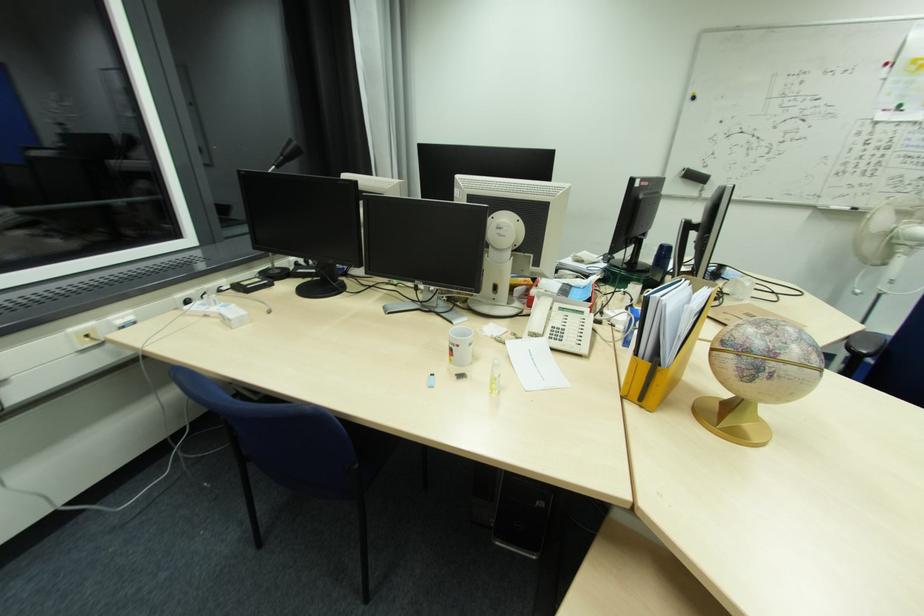
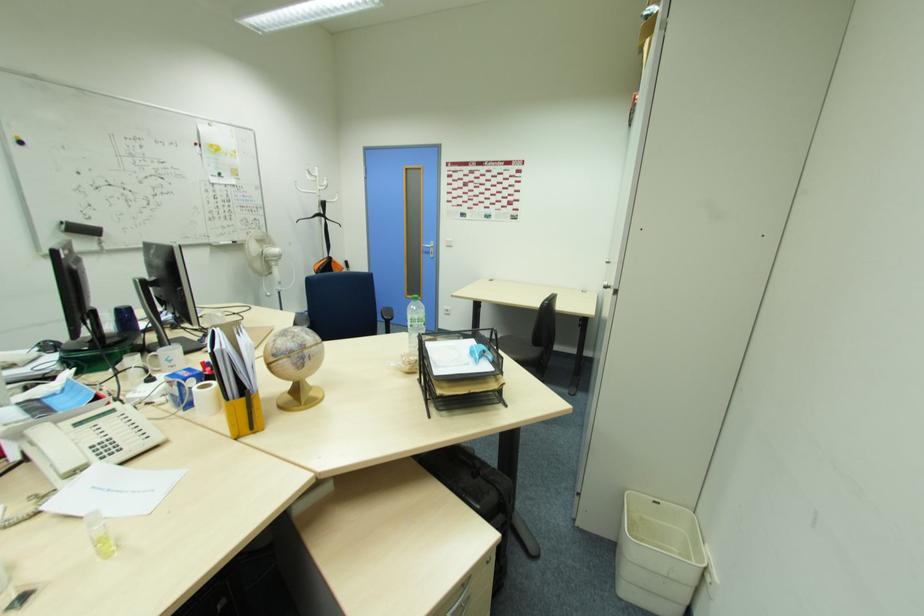
In the second image, find the point that corresponds to [780,355] in the first image.

(309, 346)